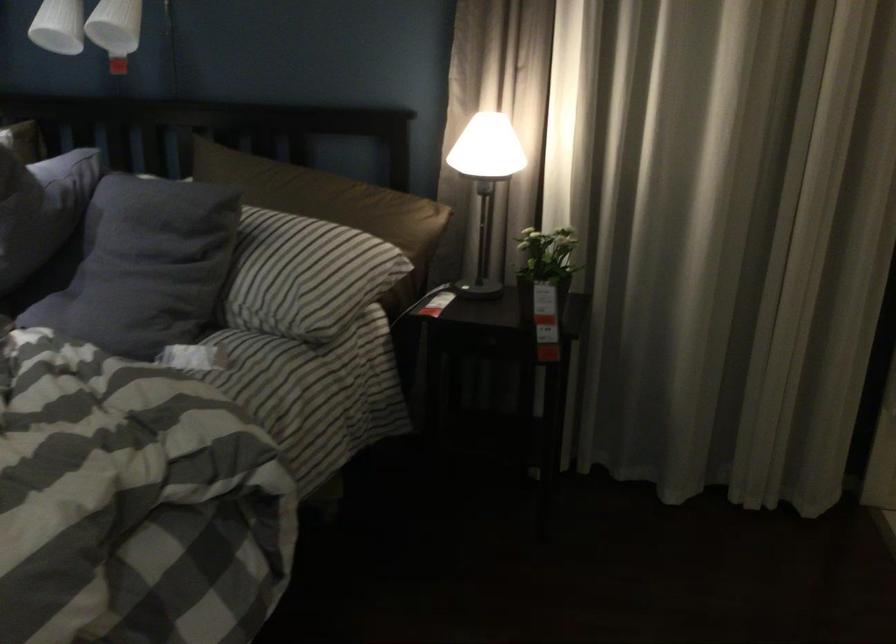
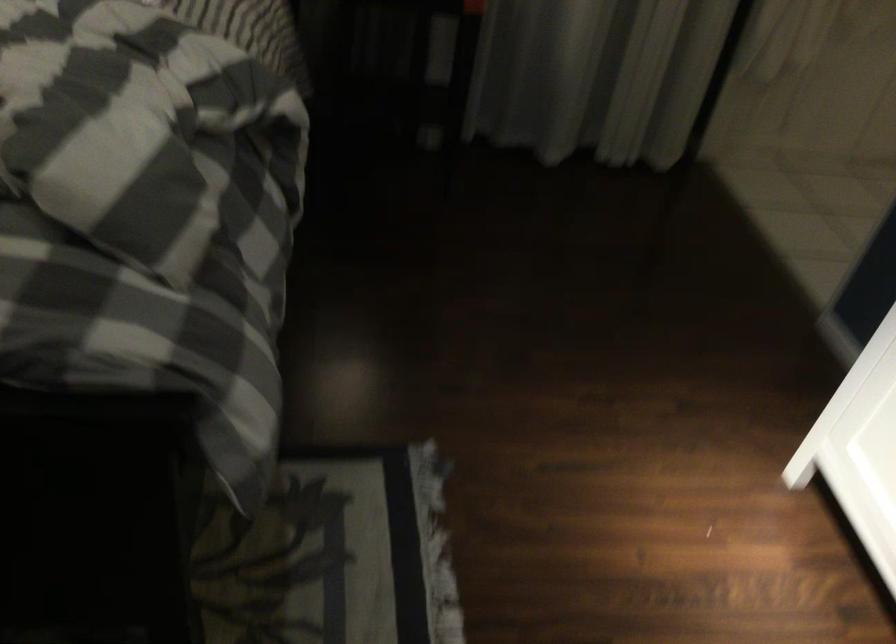
Question: In a continuous first-person perspective shot, in which direction is the camera moving?

Choices:
 (A) Left
 (B) Right
 (C) Forward
 (D) Backward

Answer: (A)